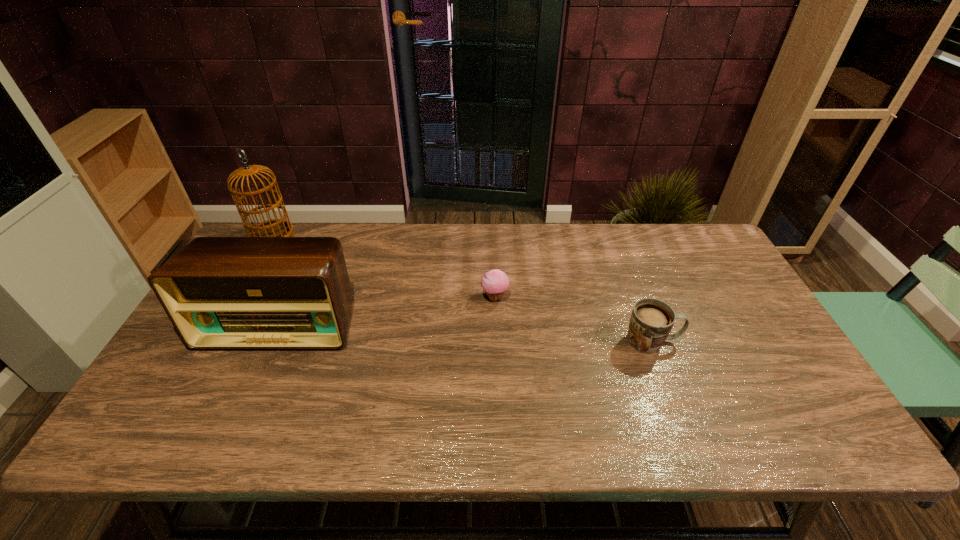
Locate an element on the screen. The image size is (960, 540). vacant region located on the right of the shortest object is located at coordinates (588, 297).

Locate an element on the screen. object located in the far edge section of the desktop is located at coordinates (276, 227).

At what (x,y) coordinates should I click in order to perform the action: click on birdcage that is at the left edge. Please return your answer as a coordinate pair (x, y). Image resolution: width=960 pixels, height=540 pixels. Looking at the image, I should click on (276, 227).

This screenshot has width=960, height=540. Identify the location of radio receiver at the left edge. (220, 293).

Locate an element on the screen. Image resolution: width=960 pixels, height=540 pixels. object situated at the far left corner is located at coordinates (276, 227).

This screenshot has width=960, height=540. What are the coordinates of `free region at the far edge of the desktop` in the screenshot? It's located at (585, 247).

Image resolution: width=960 pixels, height=540 pixels. What are the coordinates of `free space at the left edge` in the screenshot? It's located at (158, 396).

The width and height of the screenshot is (960, 540). Identify the location of vacant area at the near left corner. (141, 424).

Find the location of a particular element. Image resolution: width=960 pixels, height=540 pixels. vacant area between the third shortest object and the shortest object is located at coordinates (387, 310).

Identify the location of free space between the second tallest object and the shortest object. coord(387,310).